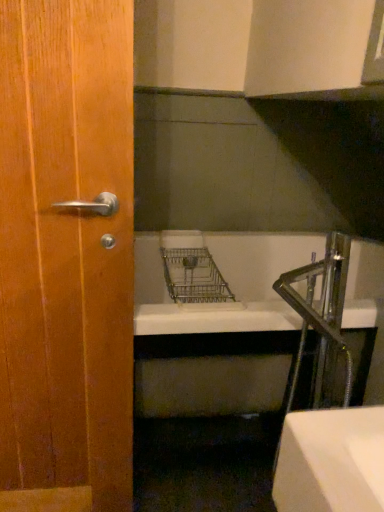
Question: Considering the positions of chrome metallic faucet at right and wooden door handle at left in the image, is chrome metallic faucet at right taller or shorter than wooden door handle at left?

Choices:
 (A) tall
 (B) short

Answer: (B)

Question: From the image's perspective, is chrome metallic faucet at right above or below wooden door handle at left?

Choices:
 (A) below
 (B) above

Answer: (A)

Question: Is point pos(334,321) closer or farther from the camera than point pos(19,52)?

Choices:
 (A) closer
 (B) farther

Answer: (B)

Question: Is wooden door handle at left spatially inside chrome metallic faucet at right, or outside of it?

Choices:
 (A) outside
 (B) inside

Answer: (A)

Question: Is wooden door handle at left taller or shorter than chrome metallic faucet at right?

Choices:
 (A) short
 (B) tall

Answer: (B)

Question: From the image's perspective, is wooden door handle at left located above or below chrome metallic faucet at right?

Choices:
 (A) below
 (B) above

Answer: (B)

Question: Visually, is wooden door handle at left positioned to the left or to the right of chrome metallic faucet at right?

Choices:
 (A) right
 (B) left

Answer: (B)